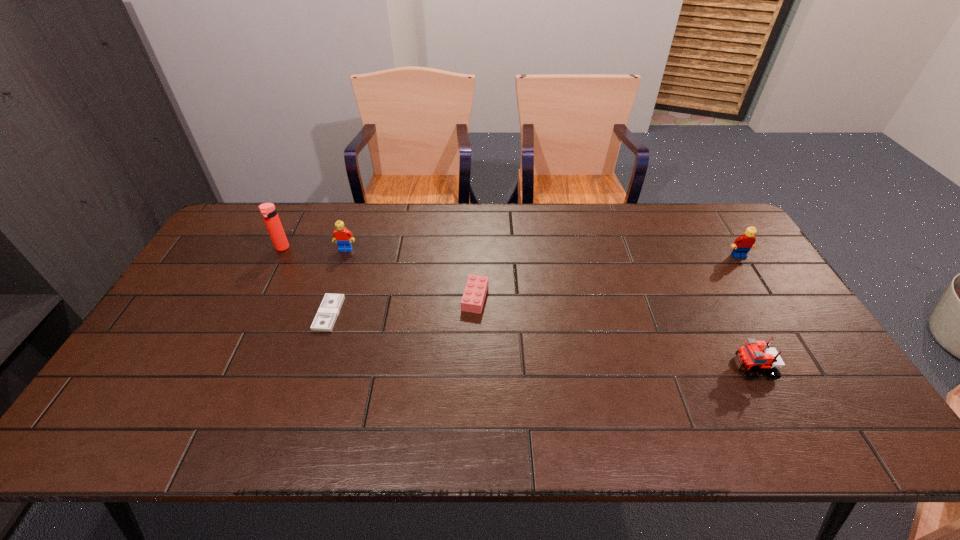
Where is `vacant space positioned on the back of the thermos bottle`? The height and width of the screenshot is (540, 960). vacant space positioned on the back of the thermos bottle is located at coordinates [x=296, y=221].

Locate an element on the screen. vacant space located 0.170m on the front-facing side of the rightmost object is located at coordinates (765, 298).

Where is `free region located 0.300m on the face of the farthest Lego`? This screenshot has height=540, width=960. free region located 0.300m on the face of the farthest Lego is located at coordinates (322, 322).

Where is `vacant area situated 0.220m on the front-facing side of the fifth object from left to right`? The image size is (960, 540). vacant area situated 0.220m on the front-facing side of the fifth object from left to right is located at coordinates (647, 368).

This screenshot has width=960, height=540. I want to click on free region located on the front-facing side of the fifth object from left to right, so click(x=642, y=368).

At what (x,y) coordinates should I click in order to perform the action: click on vacant region located on the front-facing side of the fifth object from left to right. Please return your answer as a coordinate pair (x, y). Looking at the image, I should click on (702, 368).

Where is `free spot located 0.200m on the back of the second nearest Lego`? free spot located 0.200m on the back of the second nearest Lego is located at coordinates 475,241.

You are a GUI agent. You are given a task and a screenshot of the screen. Output one action in this format:
    pyautogui.click(x=<x>, y=<y>)
    Task: Click on the free space located on the left of the shortest object
    The image size is (960, 540).
    Given the screenshot: What is the action you would take?
    pyautogui.click(x=180, y=314)

Identify the location of thermos bottle positioned at the far edge. The height and width of the screenshot is (540, 960). (268, 211).

Find the location of a particular element. Lego at the far edge is located at coordinates (343, 237).